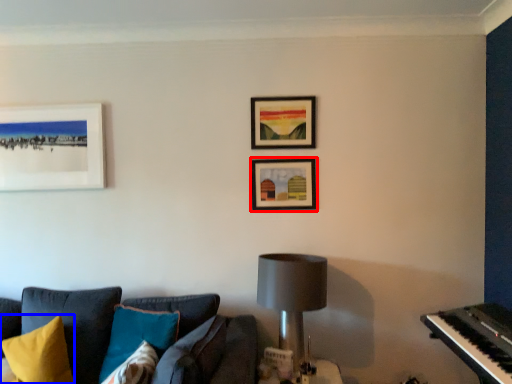
Question: Among these objects, which one is farthest to the camera, picture frame (highlighted by a red box) or pillow (highlighted by a blue box)?

Choices:
 (A) picture frame
 (B) pillow

Answer: (A)